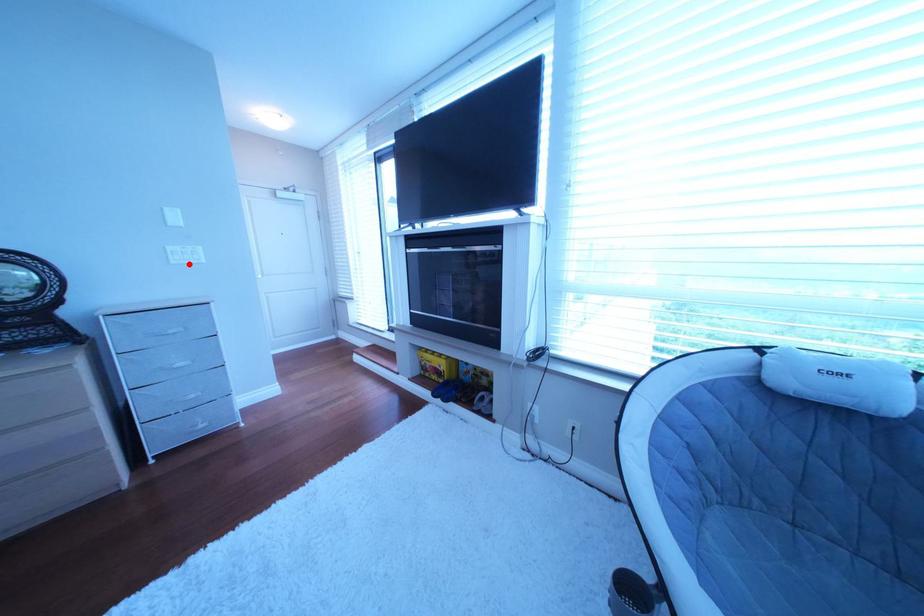
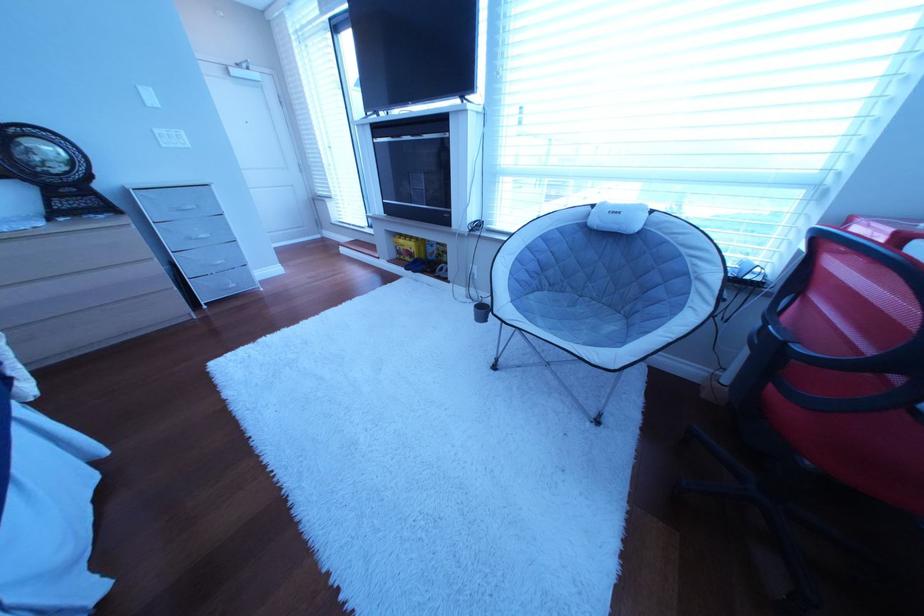
Where in the second image is the point corresponding to the highlighted location from the first image?

(179, 148)